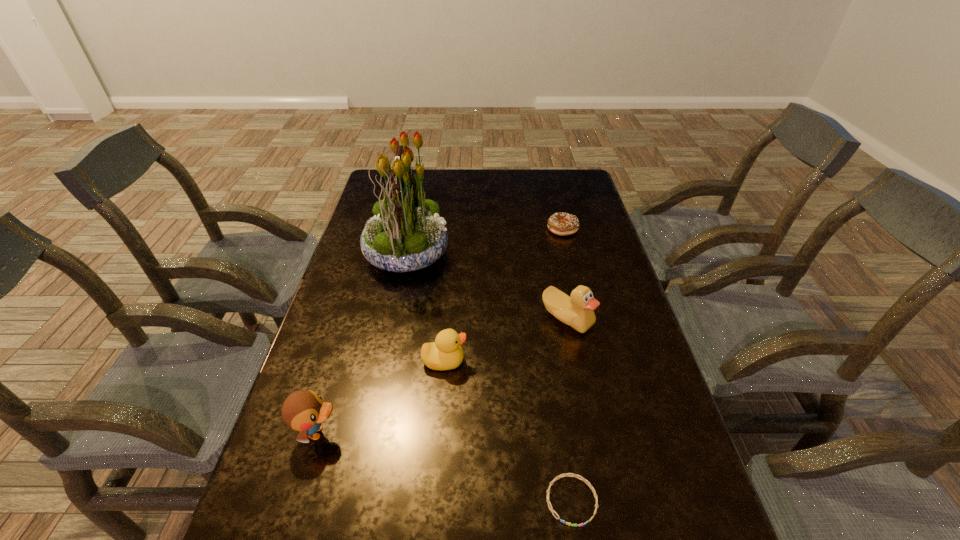
At what (x,y) coordinates should I click in order to perform the action: click on free area in between the doughnut and the tallest object. Please return your answer as a coordinate pair (x, y). The height and width of the screenshot is (540, 960). Looking at the image, I should click on (485, 241).

You are a GUI agent. You are given a task and a screenshot of the screen. Output one action in this format:
    pyautogui.click(x=<x>, y=<y>)
    Task: Click on the free spot between the bracelet and the doughnut
    The width and height of the screenshot is (960, 540).
    Given the screenshot: What is the action you would take?
    pyautogui.click(x=567, y=364)

Image resolution: width=960 pixels, height=540 pixels. Identify the location of free space between the second nearest duck and the third farthest object. (506, 340).

Where is `object that is the fifth closest to the doughnut`? object that is the fifth closest to the doughnut is located at coordinates (304, 410).

This screenshot has width=960, height=540. What are the coordinates of `object that is the fourth nearest to the rightmost duck` in the screenshot? It's located at (565, 474).

Point out which duck is positioned as the nearest to the second shortest object. Please provide its 2D coordinates. Your answer should be formatted as a tuple, i.e. [(x, y)], where the tuple contains the x and y coordinates of a point satisfying the conditions above.

[(577, 311)]

Identify the location of duck that can be found as the second closest to the shortest duck. (577, 311).

Locate an element on the screen. vacant area that satisfies the following two spatial constraints: 1. at the beak of the rightmost duck; 2. on the front-facing side of the leftmost duck is located at coordinates (590, 433).

What are the coordinates of `free location that satisfies the following two spatial constraints: 1. at the beak of the rightmost duck; 2. on the front-facing side of the nearest duck` in the screenshot? It's located at (590, 433).

At what (x,y) coordinates should I click in order to perform the action: click on free space that satisfies the following two spatial constraints: 1. at the beak of the fourth nearest object; 2. at the beak of the shortest duck. Please return your answer as a coordinate pair (x, y). Looking at the image, I should click on (576, 361).